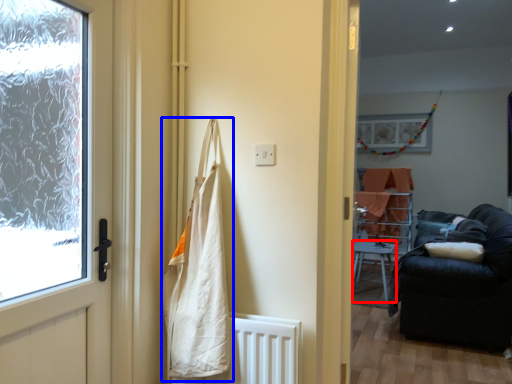
Question: Which object appears farthest to the camera in this image, furniture (highlighted by a red box) or shopping bag (highlighted by a blue box)?

Choices:
 (A) furniture
 (B) shopping bag

Answer: (A)